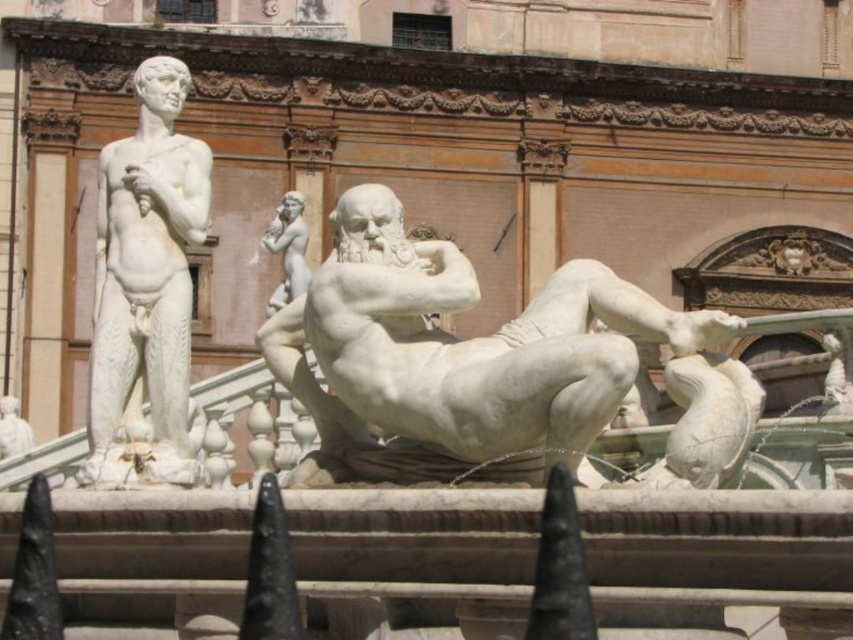
Question: Is white marble reclining figure at center positioned behind white marble statue at center?

Choices:
 (A) no
 (B) yes

Answer: (A)

Question: Does white marble statue at left lie behind white marble statue at center?

Choices:
 (A) yes
 (B) no

Answer: (B)

Question: Which of the following is the farthest from the observer?

Choices:
 (A) white marble statue at left
 (B) white marble reclining figure at center
 (C) white marble statue at center

Answer: (C)

Question: Which object is closer to the camera taking this photo?

Choices:
 (A) white marble reclining figure at center
 (B) white marble statue at center
 (C) white marble statue at left

Answer: (A)

Question: Does white marble statue at left come in front of white marble statue at center?

Choices:
 (A) yes
 (B) no

Answer: (A)

Question: Which point is farther to the camera?

Choices:
 (A) white marble reclining figure at center
 (B) white marble statue at center

Answer: (B)